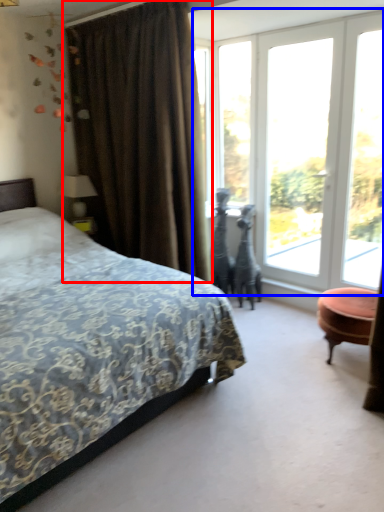
Question: Which of the following is the farthest to the observer, curtain (highlighted by a red box) or window (highlighted by a blue box)?

Choices:
 (A) curtain
 (B) window

Answer: (B)